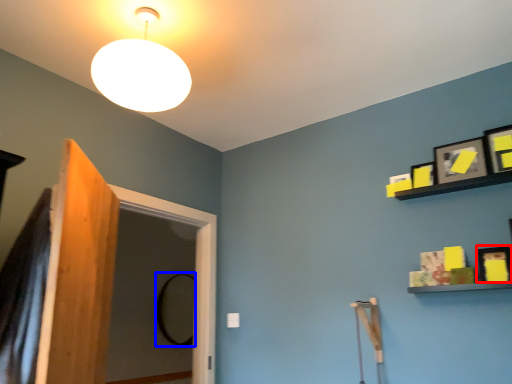
Question: Which of the following is the farthest to the observer, picture frame (highlighted by a red box) or mirror (highlighted by a blue box)?

Choices:
 (A) picture frame
 (B) mirror

Answer: (B)